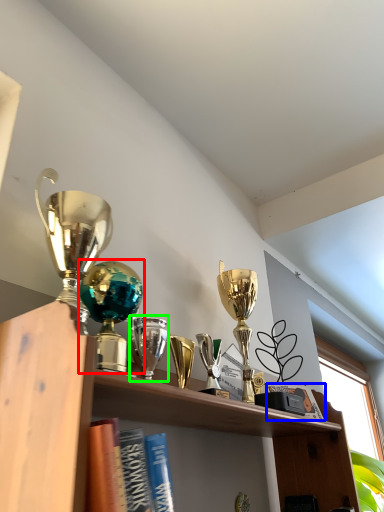
Question: Which object is positioned closest to trophy (highlighted by a red box)? Select from book (highlighted by a blue box) and trophy (highlighted by a green box).

Choices:
 (A) book
 (B) trophy

Answer: (B)